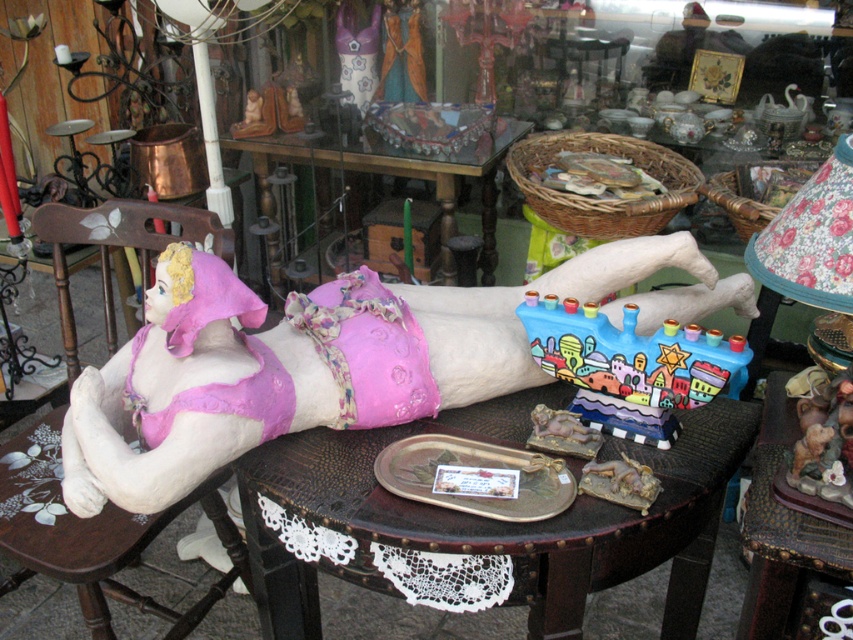
Question: Which object appears farthest from the camera in this image?

Choices:
 (A) wooden chair at left
 (B) glass/marble table at center

Answer: (B)

Question: Does pink fabric doll at center have a lesser width compared to painted ceramic menorah at center?

Choices:
 (A) yes
 (B) no

Answer: (B)

Question: Does painted ceramic menorah at center lie in front of glass/marble table at center?

Choices:
 (A) no
 (B) yes

Answer: (B)

Question: Estimate the real-world distances between objects in this image. Which object is farther from the painted ceramic menorah at center?

Choices:
 (A) leather-like dark brown table at center
 (B) wooden table at center

Answer: (B)

Question: Is leather-like dark brown table at center smaller than painted ceramic menorah at center?

Choices:
 (A) no
 (B) yes

Answer: (A)

Question: Which point is farther to the camera?

Choices:
 (A) glass/marble table at center
 (B) wooden chair at left
 (C) painted ceramic menorah at center
 (D) wooden table at center

Answer: (A)